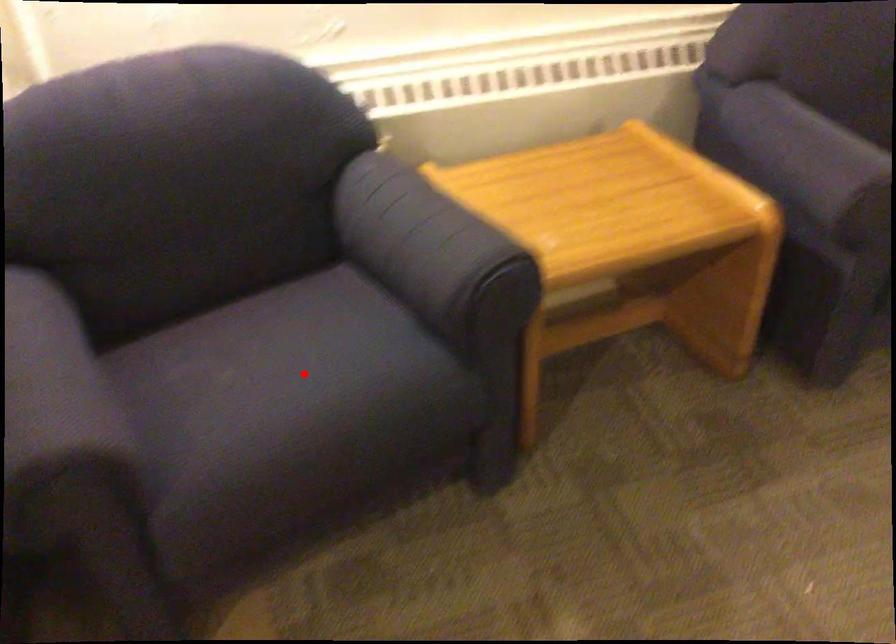
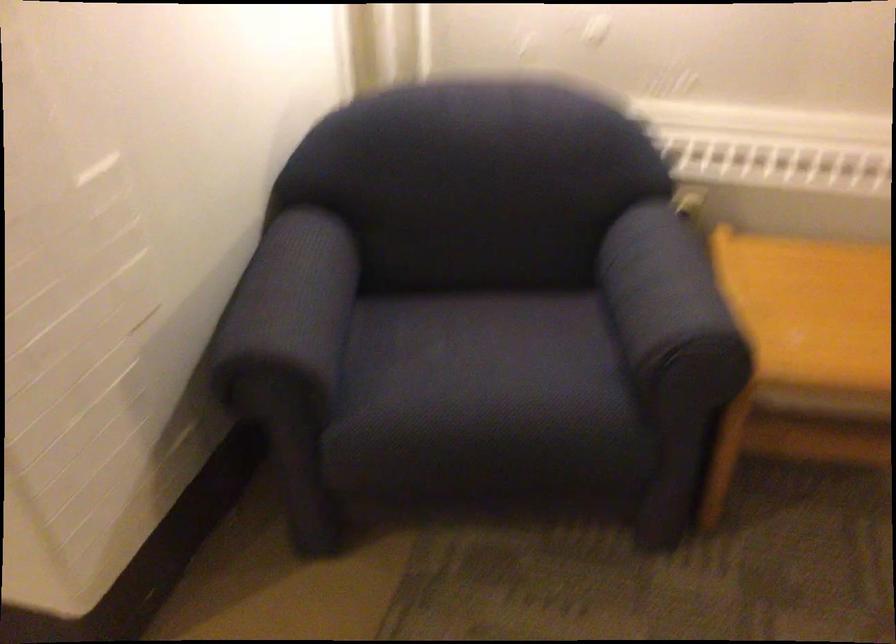
Locate, in the second image, the point that corresponds to the highlighted location in the first image.

(485, 366)